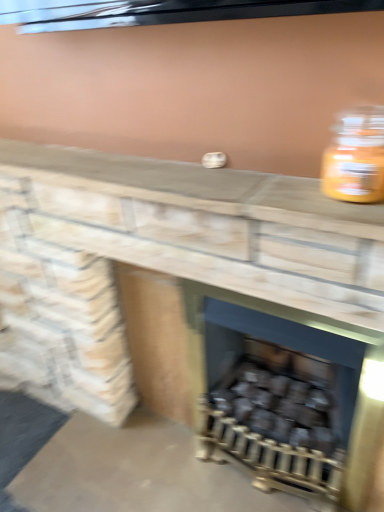
Question: Would you say black matte wood at center is a long distance from dark gray matte wood burning stove at center?

Choices:
 (A) yes
 (B) no

Answer: (B)

Question: Is black matte wood at center positioned before dark gray matte wood burning stove at center?

Choices:
 (A) yes
 (B) no

Answer: (B)

Question: From a real-world perspective, is black matte wood at center below dark gray matte wood burning stove at center?

Choices:
 (A) no
 (B) yes

Answer: (B)

Question: Is black matte wood at center in contact with dark gray matte wood burning stove at center?

Choices:
 (A) yes
 (B) no

Answer: (B)

Question: Could you tell me if black matte wood at center is turned towards dark gray matte wood burning stove at center?

Choices:
 (A) no
 (B) yes

Answer: (B)

Question: From a real-world perspective, is smooth stone fireplace at center positioned above or below black matte wood at center?

Choices:
 (A) below
 (B) above

Answer: (B)

Question: In terms of height, does smooth stone fireplace at center look taller or shorter compared to black matte wood at center?

Choices:
 (A) short
 (B) tall

Answer: (B)

Question: In the image, is smooth stone fireplace at center on the left side or the right side of black matte wood at center?

Choices:
 (A) right
 (B) left

Answer: (B)

Question: Considering the positions of point (228, 438) and point (254, 357), is point (228, 438) closer or farther from the camera than point (254, 357)?

Choices:
 (A) closer
 (B) farther

Answer: (A)

Question: Is point (238, 219) positioned closer to the camera than point (370, 448)?

Choices:
 (A) closer
 (B) farther

Answer: (A)

Question: From a real-world perspective, is smooth stone fireplace at center positioned above or below dark gray matte wood burning stove at center?

Choices:
 (A) above
 (B) below

Answer: (A)

Question: Looking at their shapes, would you say smooth stone fireplace at center is wider or thinner than dark gray matte wood burning stove at center?

Choices:
 (A) wide
 (B) thin

Answer: (B)

Question: From their relative heights in the image, would you say smooth stone fireplace at center is taller or shorter than dark gray matte wood burning stove at center?

Choices:
 (A) tall
 (B) short

Answer: (A)

Question: Is smooth stone counter at center taller or shorter than translucent glass jar at upper right?

Choices:
 (A) tall
 (B) short

Answer: (B)

Question: From a real-world perspective, is smooth stone counter at center positioned above or below translucent glass jar at upper right?

Choices:
 (A) below
 (B) above

Answer: (A)